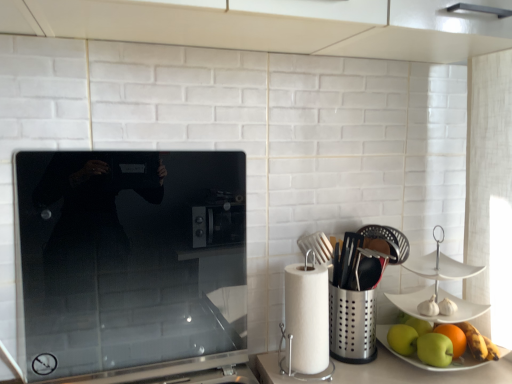
Measure the distance between orange matte at right and camera.

A distance of 39.29 inches exists between orange matte at right and camera.

Describe the element at coordinates (435, 349) in the screenshot. I see `green matte apple at lower right, acting as the second apple starting from the left` at that location.

Image resolution: width=512 pixels, height=384 pixels. Describe the element at coordinates (402, 339) in the screenshot. I see `green matte apple at lower right, the 1th apple from the left` at that location.

The width and height of the screenshot is (512, 384). What do you see at coordinates (131, 266) in the screenshot?
I see `smooth glass cooktop at center` at bounding box center [131, 266].

Find the location of a particular element. This screenshot has height=384, width=512. orange matte at right is located at coordinates (453, 338).

Where is `apple that is the 1st object located below the smooth glass cooktop at center (from the image's perspective)`? apple that is the 1st object located below the smooth glass cooktop at center (from the image's perspective) is located at coordinates (402, 339).

Considering the positions of point (46, 178) and point (396, 344), is point (46, 178) closer or farther from the camera than point (396, 344)?

Point (46, 178).

From a real-world perspective, is smooth glass cooktop at center over green matte apple at lower right, which ranks as the third apple in right-to-left order?

Yes, from a real-world perspective, smooth glass cooktop at center is on top of green matte apple at lower right, which ranks as the third apple in right-to-left order.

Can you confirm if smooth glass cooktop at center is taller than green matte apple at lower right, which ranks as the third apple in right-to-left order?

Yes.

From a real-world perspective, is green matte apple at lower right, which ranks as the third apple in right-to-left order, located beneath green matte apple at lower right, which is counted as the 3th apple, starting from the left?

No, from a real-world perspective, green matte apple at lower right, which ranks as the third apple in right-to-left order, is not below green matte apple at lower right, which is counted as the 3th apple, starting from the left.

Considering their positions, is green matte apple at lower right, the 1th apple from the left, located in front of or behind green matte apple at lower right, which is counted as the 3th apple, starting from the left?

In the image, green matte apple at lower right, the 1th apple from the left, appears behind green matte apple at lower right, which is counted as the 3th apple, starting from the left.

Is green matte apple at lower right, which ranks as the third apple in right-to-left order, with green matte apple at lower right, which is counted as the 3th apple, starting from the left?

Absolutely, green matte apple at lower right, which ranks as the third apple in right-to-left order, is next to and touching green matte apple at lower right, which is counted as the 3th apple, starting from the left.

How many degrees apart are the facing directions of green matte apple at lower right, which ranks as the third apple in right-to-left order, and green matte apple at lower right, which is counted as the 3th apple, starting from the left?

The facing directions of green matte apple at lower right, which ranks as the third apple in right-to-left order, and green matte apple at lower right, which is counted as the 3th apple, starting from the left, are 9.03e-05 degrees apart.

Is green matte apple at lower right, which ranks as the first apple in right-to-left order, at the left side of green matte apple at lower right, which ranks as the third apple in right-to-left order?

No, green matte apple at lower right, which ranks as the first apple in right-to-left order, is not to the left of green matte apple at lower right, which ranks as the third apple in right-to-left order.

Can you confirm if green matte apple at lower right, which ranks as the first apple in right-to-left order, is taller than green matte apple at lower right, which ranks as the third apple in right-to-left order?

Yes.

From a real-world perspective, relative to green matte apple at lower right, which ranks as the third apple in right-to-left order, is green matte apple at lower right, which is counted as the 3th apple, starting from the left, vertically above or below?

green matte apple at lower right, which is counted as the 3th apple, starting from the left, is situated lower than green matte apple at lower right, which ranks as the third apple in right-to-left order, in the real world.

Is green matte apple at lower right, the 1th apple from the left, at the back of green matte apple at lower right, which is counted as the 3th apple, starting from the left?

No, green matte apple at lower right, which is counted as the 3th apple, starting from the left, is not facing the opposite direction of green matte apple at lower right, the 1th apple from the left.

Measure the distance between green matte apple at lower right, which ranks as the first apple in right-to-left order, and smooth glass cooktop at center.

A distance of 25.98 inches exists between green matte apple at lower right, which ranks as the first apple in right-to-left order, and smooth glass cooktop at center.

From their relative heights in the image, would you say green matte apple at lower right, which ranks as the first apple in right-to-left order, is taller or shorter than smooth glass cooktop at center?

green matte apple at lower right, which ranks as the first apple in right-to-left order, is shorter than smooth glass cooktop at center.

Is green matte apple at lower right, which ranks as the first apple in right-to-left order, not near smooth glass cooktop at center?

No, green matte apple at lower right, which ranks as the first apple in right-to-left order, is not far away from smooth glass cooktop at center.

From the picture: How different are the orientations of green matte apple at lower right, which is counted as the 3th apple, starting from the left, and smooth glass cooktop at center in degrees?

green matte apple at lower right, which is counted as the 3th apple, starting from the left, and smooth glass cooktop at center are facing 1.23 degrees away from each other.

Is smooth glass cooktop at center at the left side of white paper towel at right?

Yes, smooth glass cooktop at center is to the left of white paper towel at right.

Considering the relative sizes of smooth glass cooktop at center and white paper towel at right in the image provided, is smooth glass cooktop at center smaller than white paper towel at right?

No.

Is smooth glass cooktop at center in front of or behind white paper towel at right in the image?

Visually, smooth glass cooktop at center is located in front of white paper towel at right.

Is smooth glass cooktop at center wider than white paper towel at right?

No.

In the scene shown: Is orange matte at right aimed at green matte apple at lower right, which ranks as the first apple in right-to-left order?

Yes, orange matte at right faces towards green matte apple at lower right, which ranks as the first apple in right-to-left order.

From a real-world perspective, is orange matte at right beneath green matte apple at lower right, which ranks as the first apple in right-to-left order?

Correct, in the physical world, orange matte at right is lower than green matte apple at lower right, which ranks as the first apple in right-to-left order.

Is orange matte at right in front of or behind green matte apple at lower right, which ranks as the first apple in right-to-left order, in the image?

orange matte at right is positioned farther from the viewer than green matte apple at lower right, which ranks as the first apple in right-to-left order.

Would you say orange matte at right contains green matte apple at lower right, which ranks as the first apple in right-to-left order?

That's incorrect, green matte apple at lower right, which ranks as the first apple in right-to-left order, is not inside orange matte at right.

Consider the image. Is white paper towel at right facing towards green matte apple at lower right, acting as the second apple starting from the left?

No, white paper towel at right does not turn towards green matte apple at lower right, acting as the second apple starting from the left.

How different are the orientations of white paper towel at right and green matte apple at lower right, arranged as the second apple when viewed from the right, in degrees?

The facing directions of white paper towel at right and green matte apple at lower right, arranged as the second apple when viewed from the right, are 3.45 degrees apart.

Would you say white paper towel at right is a long distance from green matte apple at lower right, arranged as the second apple when viewed from the right?

No, white paper towel at right is not far from green matte apple at lower right, arranged as the second apple when viewed from the right.

Can you confirm if white paper towel at right is positioned to the right of green matte apple at lower right, acting as the second apple starting from the left?

In fact, white paper towel at right is to the left of green matte apple at lower right, acting as the second apple starting from the left.

There is a green matte apple at lower right, the 1th apple from the left. Where is `kitchen appliance above it (from a real-world perspective)`? kitchen appliance above it (from a real-world perspective) is located at coordinates (131, 266).

Where is `apple that is the 2nd object to the right of the green matte apple at lower right, which ranks as the third apple in right-to-left order, starting at the anchor`? The width and height of the screenshot is (512, 384). apple that is the 2nd object to the right of the green matte apple at lower right, which ranks as the third apple in right-to-left order, starting at the anchor is located at coordinates (422, 361).

From the image, which object appears to be nearer to smooth glass cooktop at center, green matte apple at lower right, which ranks as the first apple in right-to-left order, or green matte apple at lower right, the 1th apple from the left?

Among the two, green matte apple at lower right, which ranks as the first apple in right-to-left order, is located nearer to smooth glass cooktop at center.

When comparing their distances from green matte apple at lower right, the 1th apple from the left, does orange matte at right or green matte apple at lower right, arranged as the second apple when viewed from the right, seem further?

orange matte at right is further to green matte apple at lower right, the 1th apple from the left.

Looking at the image, which one is located closer to orange matte at right, smooth glass cooktop at center or white paper towel at right?

white paper towel at right.

Based on their spatial positions, is orange matte at right or green matte apple at lower right, acting as the second apple starting from the left, closer to green matte apple at lower right, which ranks as the first apple in right-to-left order?

green matte apple at lower right, acting as the second apple starting from the left, is positioned closer to the anchor green matte apple at lower right, which ranks as the first apple in right-to-left order.

Looking at this image, which object lies further to the anchor point green matte apple at lower right, which ranks as the first apple in right-to-left order, smooth glass cooktop at center or green matte apple at lower right, acting as the second apple starting from the left?

Among the two, smooth glass cooktop at center is located further to green matte apple at lower right, which ranks as the first apple in right-to-left order.

When comparing their distances from green matte apple at lower right, which ranks as the first apple in right-to-left order, does green matte apple at lower right, which ranks as the third apple in right-to-left order, or green matte apple at lower right, arranged as the second apple when viewed from the right, seem further?

green matte apple at lower right, which ranks as the third apple in right-to-left order, is positioned further to the anchor green matte apple at lower right, which ranks as the first apple in right-to-left order.

Which object lies nearer to the anchor point orange matte at right, green matte apple at lower right, which is counted as the 3th apple, starting from the left, or smooth glass cooktop at center?

green matte apple at lower right, which is counted as the 3th apple, starting from the left.

From the image, which object appears to be farther from white paper towel at right, green matte apple at lower right, the 1th apple from the left, or orange matte at right?

orange matte at right.

Identify the location of orange between smooth glass cooktop at center and green matte apple at lower right, which is counted as the 3th apple, starting from the left, from left to right. Image resolution: width=512 pixels, height=384 pixels. (453, 338).

Where is `orange between green matte apple at lower right, the 1th apple from the left, and green matte apple at lower right, which is counted as the 3th apple, starting from the left`? The width and height of the screenshot is (512, 384). orange between green matte apple at lower right, the 1th apple from the left, and green matte apple at lower right, which is counted as the 3th apple, starting from the left is located at coordinates (453, 338).

The width and height of the screenshot is (512, 384). Find the location of `paper towel between smooth glass cooktop at center and green matte apple at lower right, acting as the second apple starting from the left, from left to right`. paper towel between smooth glass cooktop at center and green matte apple at lower right, acting as the second apple starting from the left, from left to right is located at coordinates (306, 318).

At what (x,y) coordinates should I click in order to perform the action: click on apple between green matte apple at lower right, the 1th apple from the left, and orange matte at right. Please return your answer as a coordinate pair (x, y). This screenshot has height=384, width=512. Looking at the image, I should click on (435, 349).